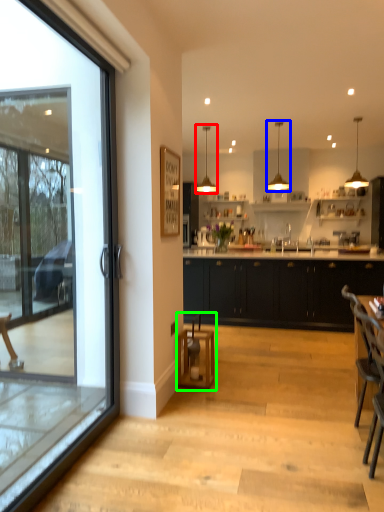
Question: Estimate the real-world distances between objects in this image. Which object is farther from lamp (highlighted by a red box), lamp (highlighted by a blue box) or bar stool (highlighted by a green box)?

Choices:
 (A) lamp
 (B) bar stool

Answer: (B)